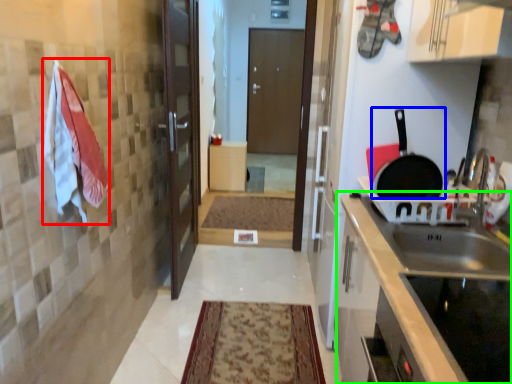
Question: Which is farther away from laundry (highlighted by a red box)? frying pan (highlighted by a blue box) or countertop (highlighted by a green box)?

Choices:
 (A) frying pan
 (B) countertop

Answer: (A)